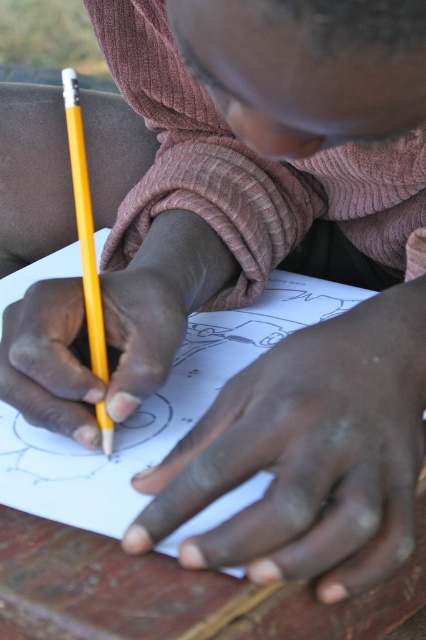
Question: Can you confirm if smooth yellow pencil at center is wider than yellow wood pencil at lower left?

Choices:
 (A) no
 (B) yes

Answer: (B)

Question: Which of the following is the closest to the observer?

Choices:
 (A) (373, 388)
 (B) (77, 131)

Answer: (A)

Question: Among these points, which one is nearest to the camera?

Choices:
 (A) (85, 202)
 (B) (373, 353)
 (C) (25, 355)

Answer: (B)

Question: Does smooth yellow pencil at center appear on the right side of yellow wood pencil at lower left?

Choices:
 (A) yes
 (B) no

Answer: (A)

Question: Which point is farther to the camera?

Choices:
 (A) (48, 417)
 (B) (363, 355)
 (C) (74, 140)

Answer: (C)

Question: Can you confirm if smooth yellow pencil at center is positioned to the right of yellow wood pencil at lower left?

Choices:
 (A) no
 (B) yes

Answer: (B)